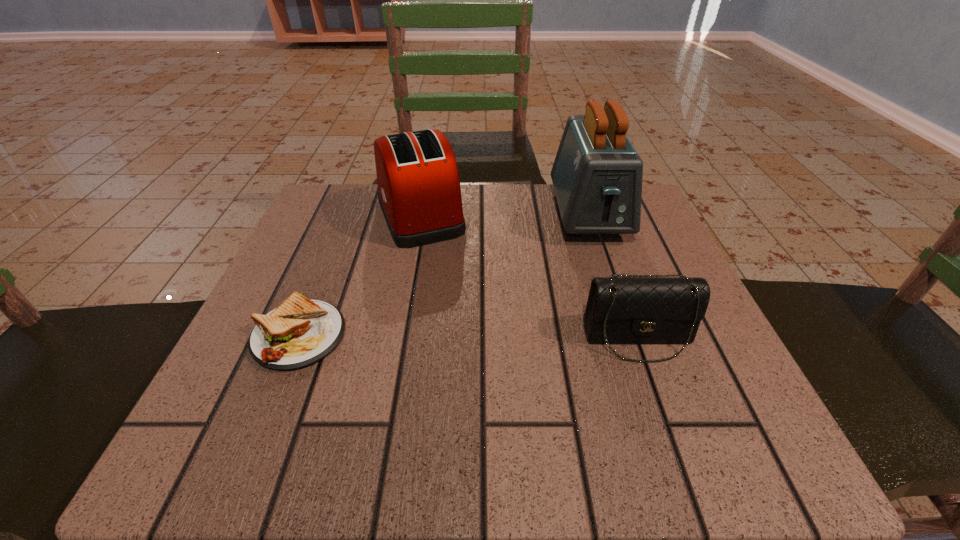
The image size is (960, 540). Identify the location of vacant space at the far left corner. (337, 238).

Where is `free space at the far right corner of the desktop`? This screenshot has height=540, width=960. free space at the far right corner of the desktop is located at coordinates click(x=645, y=208).

At what (x,y) coordinates should I click in order to perform the action: click on free spot between the sandwich and the third shortest object. Please return your answer as a coordinate pair (x, y). Looking at the image, I should click on (360, 275).

You are a GUI agent. You are given a task and a screenshot of the screen. Output one action in this format:
    pyautogui.click(x=<x>, y=<y>)
    Task: Click on the blank region between the taller toaster and the shortest object
    This screenshot has height=540, width=960.
    Given the screenshot: What is the action you would take?
    pyautogui.click(x=444, y=275)

Identify the location of empty location between the right toaster and the left toaster. This screenshot has height=540, width=960. (504, 214).

This screenshot has width=960, height=540. What are the coordinates of `vacant area between the sandwich and the tallest object` in the screenshot? It's located at (444, 275).

The width and height of the screenshot is (960, 540). Find the location of `empty space between the sandwich and the third shortest object`. empty space between the sandwich and the third shortest object is located at coordinates (360, 275).

Where is `free area in between the shortest object and the taller toaster`? The width and height of the screenshot is (960, 540). free area in between the shortest object and the taller toaster is located at coordinates (444, 275).

You are a GUI agent. You are given a task and a screenshot of the screen. Output one action in this format:
    pyautogui.click(x=<x>, y=<y>)
    Task: Click on the blank region between the third tallest object and the sandwich
    
    Given the screenshot: What is the action you would take?
    pyautogui.click(x=468, y=337)

Identify the location of vacant area between the third shortest object and the shortest object. The image size is (960, 540). coord(360,275).